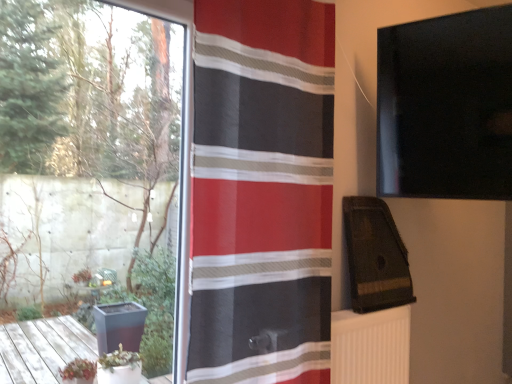
Question: From a real-world perspective, is white ribbed radiator at lower right under red striped fabric at center?

Choices:
 (A) no
 (B) yes

Answer: (B)

Question: From the image's perspective, is white ribbed radiator at lower right on top of red striped fabric at center?

Choices:
 (A) no
 (B) yes

Answer: (A)

Question: Does white ribbed radiator at lower right appear on the left side of red striped fabric at center?

Choices:
 (A) no
 (B) yes

Answer: (A)

Question: Does white ribbed radiator at lower right turn towards red striped fabric at center?

Choices:
 (A) no
 (B) yes

Answer: (A)

Question: Is white ribbed radiator at lower right far from red striped fabric at center?

Choices:
 (A) yes
 (B) no

Answer: (B)

Question: From the image's perspective, does white ribbed radiator at lower right appear lower than red striped fabric at center?

Choices:
 (A) yes
 (B) no

Answer: (A)

Question: Can you confirm if red striped fabric at center is shorter than transparent glass window at left?

Choices:
 (A) no
 (B) yes

Answer: (B)

Question: Is red striped fabric at center far away from transparent glass window at left?

Choices:
 (A) yes
 (B) no

Answer: (B)

Question: From a real-world perspective, is red striped fabric at center located beneath transparent glass window at left?

Choices:
 (A) no
 (B) yes

Answer: (A)

Question: Can you confirm if red striped fabric at center is taller than transparent glass window at left?

Choices:
 (A) no
 (B) yes

Answer: (A)

Question: Is red striped fabric at center behind transparent glass window at left?

Choices:
 (A) yes
 (B) no

Answer: (B)

Question: Would you say transparent glass window at left is part of red striped fabric at center's contents?

Choices:
 (A) no
 (B) yes

Answer: (A)

Question: Is white ribbed radiator at lower right completely or partially inside red striped fabric at center?

Choices:
 (A) no
 (B) yes

Answer: (A)